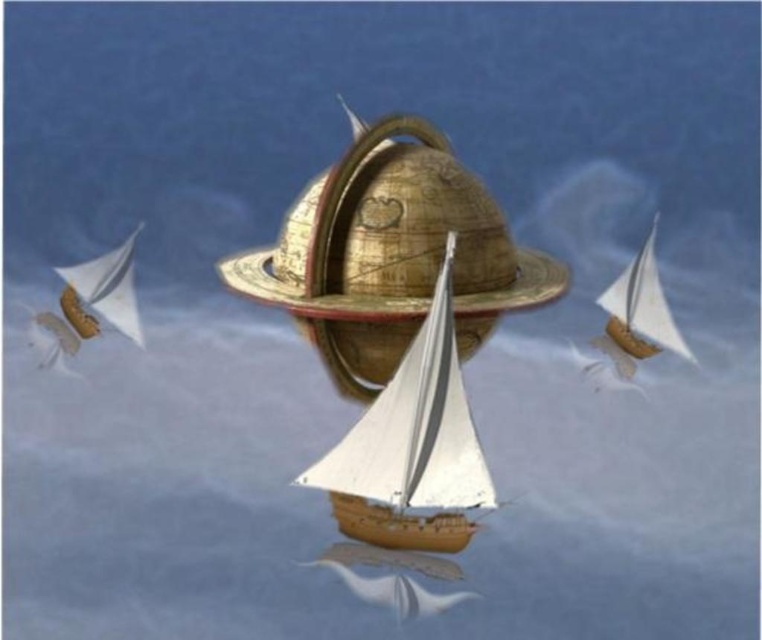
You are an astronaut floating in space and see the gold metallic globe at center and the white matte sailboat at center in the image. Which object is wider?

The gold metallic globe at center is wider than the white matte sailboat at center.

You are standing on the shore of the water and see the gold metallic globe at center and the white matte sailboat at center. Which object is located to the right when viewed from your perspective?

The gold metallic globe at center is positioned on the right side of the white matte sailboat at center, so from your perspective on the shore, the gold metallic globe at center is to the right of the white matte sailboat at center.